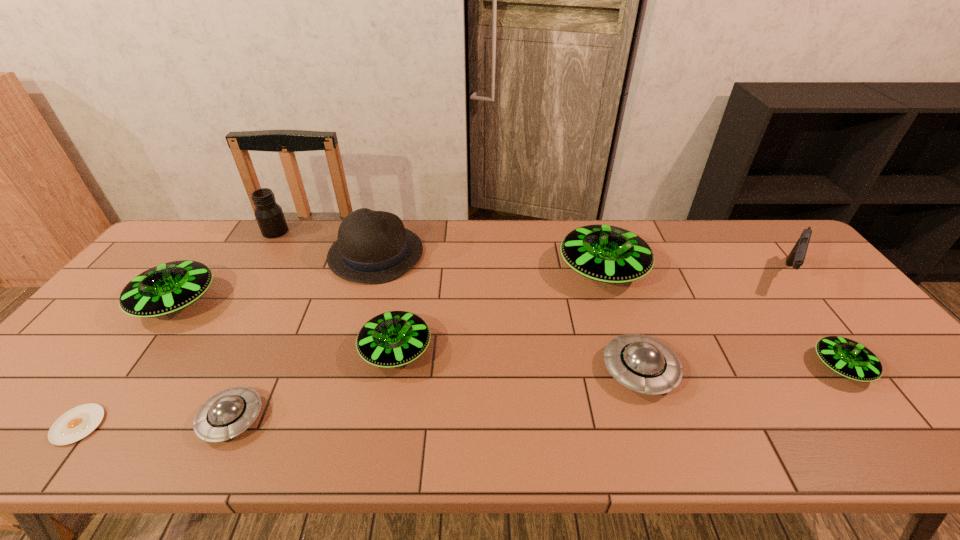
At what (x,y) coordinates should I click in order to perform the action: click on free spot between the sixth shortest object and the white egg yolk. Please return your answer as a coordinate pair (x, y). This screenshot has height=540, width=960. Looking at the image, I should click on (128, 363).

Identify which object is the eighth closest to the left gray saucer. Please provide its 2D coordinates. Your answer should be formatted as a tuple, i.e. [(x, y)], where the tuple contains the x and y coordinates of a point satisfying the conditions above.

[(850, 359)]

Point out which object is positioned as the third nearest to the leftmost green saucer. Please provide its 2D coordinates. Your answer should be formatted as a tuple, i.e. [(x, y)], where the tuple contains the x and y coordinates of a point satisfying the conditions above.

[(225, 415)]

Choose which saucer is the third nearest neighbor to the white egg yolk. Please provide its 2D coordinates. Your answer should be formatted as a tuple, i.e. [(x, y)], where the tuple contains the x and y coordinates of a point satisfying the conditions above.

[(392, 339)]

Identify the location of saucer that can be found as the fifth closest to the jar. (641, 363).

Choose which green saucer is the third nearest neighbor to the bowler hat. Please provide its 2D coordinates. Your answer should be formatted as a tuple, i.e. [(x, y)], where the tuple contains the x and y coordinates of a point satisfying the conditions above.

[(609, 254)]

Identify which green saucer is located as the nearest to the second smallest green saucer. Please provide its 2D coordinates. Your answer should be formatted as a tuple, i.e. [(x, y)], where the tuple contains the x and y coordinates of a point satisfying the conditions above.

[(609, 254)]

Find the location of a particular element. The image size is (960, 540). vacant region that satisfies the following two spatial constraints: 1. on the front-facing side of the bowler hat; 2. on the right side of the second green saucer from left to right is located at coordinates (348, 350).

Where is `vacant space that satisfies the following two spatial constraints: 1. on the back side of the smaller gray saucer; 2. on the left side of the third green saucer from right to left`? The height and width of the screenshot is (540, 960). vacant space that satisfies the following two spatial constraints: 1. on the back side of the smaller gray saucer; 2. on the left side of the third green saucer from right to left is located at coordinates (264, 350).